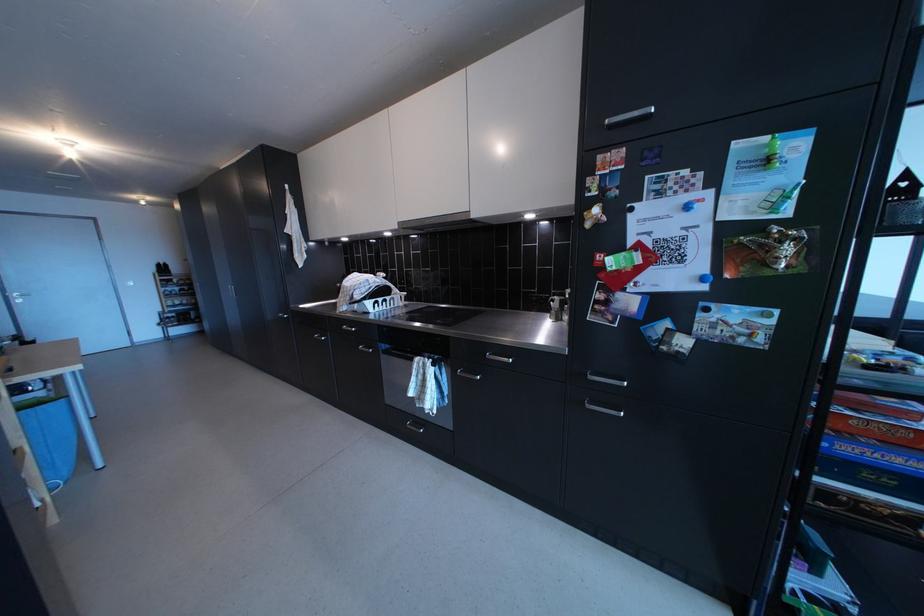
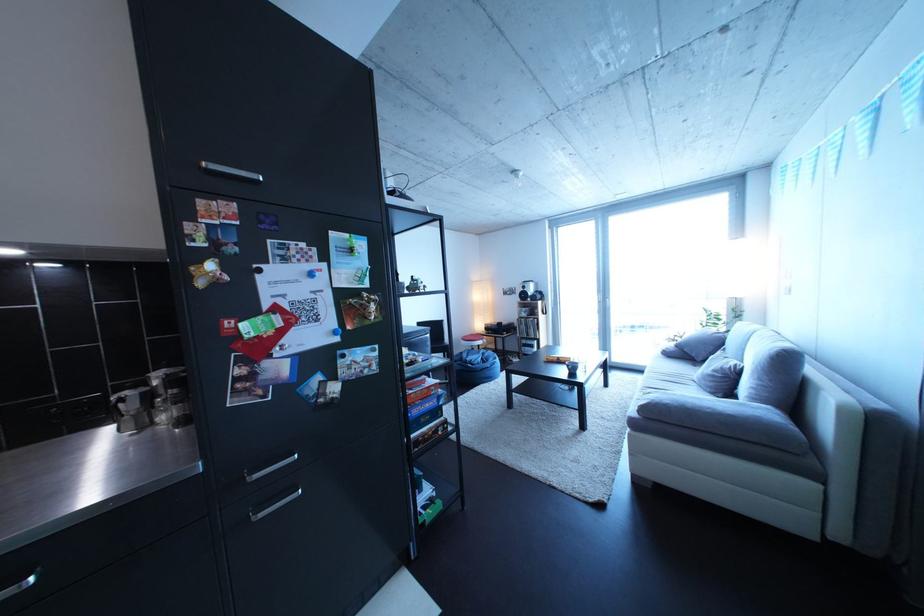
In the second image, find the point that corresponds to [869,416] in the first image.

(424, 395)